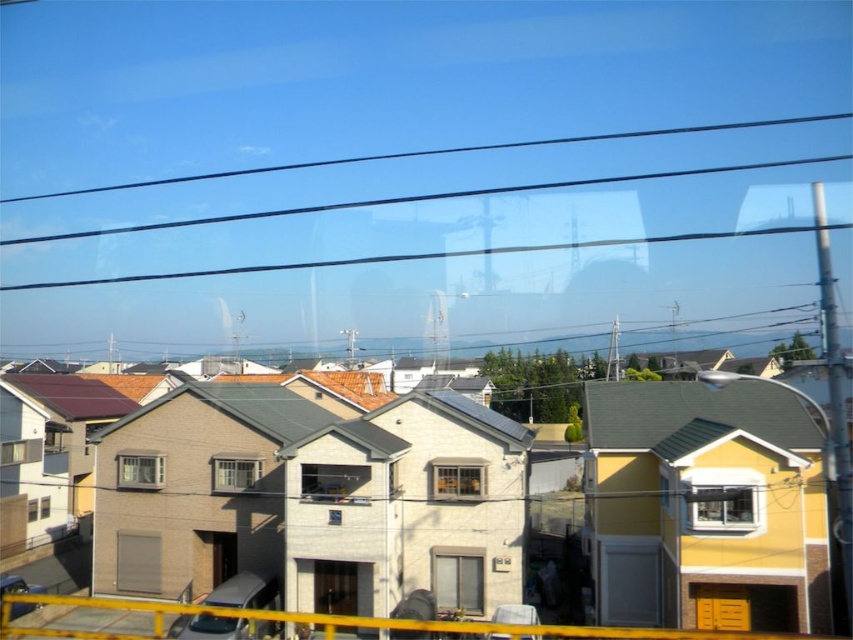
The image size is (853, 640). What are the coordinates of `transparent glass power line at upper center` in the screenshot? It's located at (431, 154).

Describe the element at coordinates (431, 154) in the screenshot. I see `transparent glass power line at upper center` at that location.

Is point (372, 157) positioned behind point (454, 493)?

That is True.

Find the location of a particular element. transparent glass power line at upper center is located at coordinates (431, 154).

Is transparent glass power line at upper center shorter than matte glass window at center?

In fact, transparent glass power line at upper center may be taller than matte glass window at center.

Is point (204, 173) closer to camera compared to point (154, 481)?

No, (204, 173) is further to viewer.

Image resolution: width=853 pixels, height=640 pixels. I want to click on transparent glass power line at upper center, so click(x=431, y=154).

Is point (712, 515) farther from viewer compared to point (119, 460)?

No, (712, 515) is in front of (119, 460).

Can you confirm if transparent glass window at center is positioned to the left of matte glass window at center?

No, transparent glass window at center is not to the left of matte glass window at center.

Between point (735, 497) and point (126, 483), which one is positioned in front?

Point (735, 497) is in front.

Identify the location of transparent glass window at center. This screenshot has height=640, width=853. (721, 506).